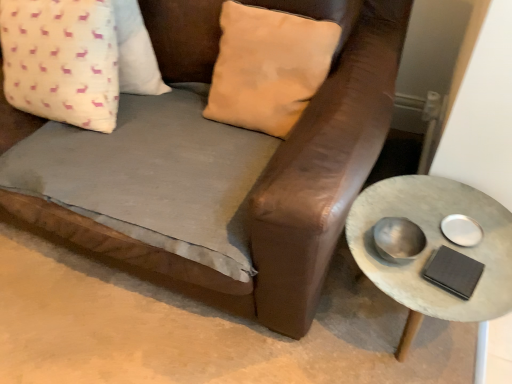
Question: Is brown leather couch at center bigger or smaller than beige suede pillow at upper center, which is the first pillow in right-to-left order?

Choices:
 (A) big
 (B) small

Answer: (A)

Question: Is point (313, 107) closer or farther from the camera than point (229, 102)?

Choices:
 (A) farther
 (B) closer

Answer: (B)

Question: Which of these objects is positioned farthest from the brown leather couch at center?

Choices:
 (A) beige suede pillow at upper center, which is the 2th pillow from left to right
 (B) rustic concrete side table at right
 (C) white fabric pillow with pink deer pattern at upper left, the 2th pillow positioned from the right

Answer: (B)

Question: Considering the real-world distances, which object is farthest from the beige suede pillow at upper center, which is the 2th pillow from left to right?

Choices:
 (A) brown leather couch at center
 (B) white fabric pillow with pink deer pattern at upper left, placed as the 1th pillow when sorted from left to right
 (C) rustic concrete side table at right

Answer: (C)